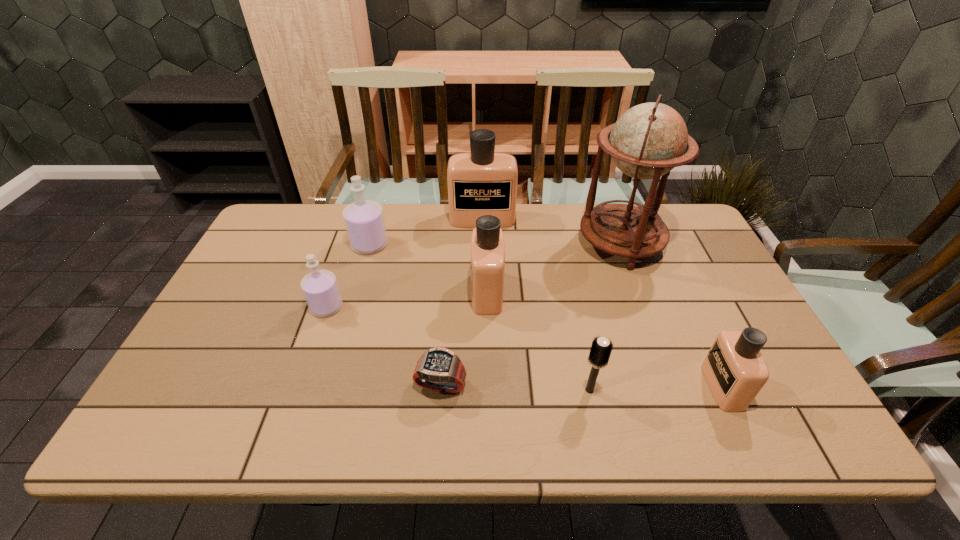
Identify which beige perfume is the second closest to the smaller purple perfume. Please provide its 2D coordinates. Your answer should be formatted as a tuple, i.e. [(x, y)], where the tuple contains the x and y coordinates of a point satisfying the conditions above.

[(482, 182)]

Locate an element on the screen. This screenshot has height=540, width=960. beige perfume identified as the third closest to the bigger purple perfume is located at coordinates (735, 371).

This screenshot has height=540, width=960. Find the location of `vacant space that satisfies the following two spatial constraints: 1. on the front side of the sixth object from left to right; 2. on the right side of the farther purple perfume`. vacant space that satisfies the following two spatial constraints: 1. on the front side of the sixth object from left to right; 2. on the right side of the farther purple perfume is located at coordinates (327, 390).

The image size is (960, 540). I want to click on blank area in the image that satisfies the following two spatial constraints: 1. on the surface of the globe; 2. on the front side of the farther purple perfume, so click(620, 245).